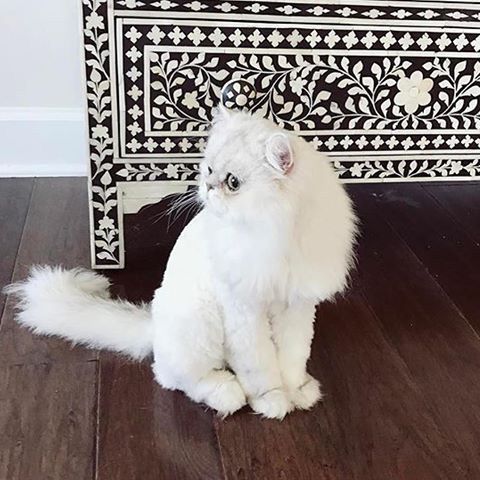
I want to click on floorboards, so click(x=55, y=425), click(x=13, y=209), click(x=168, y=456), click(x=314, y=442), click(x=443, y=249), click(x=406, y=306), click(x=459, y=199).